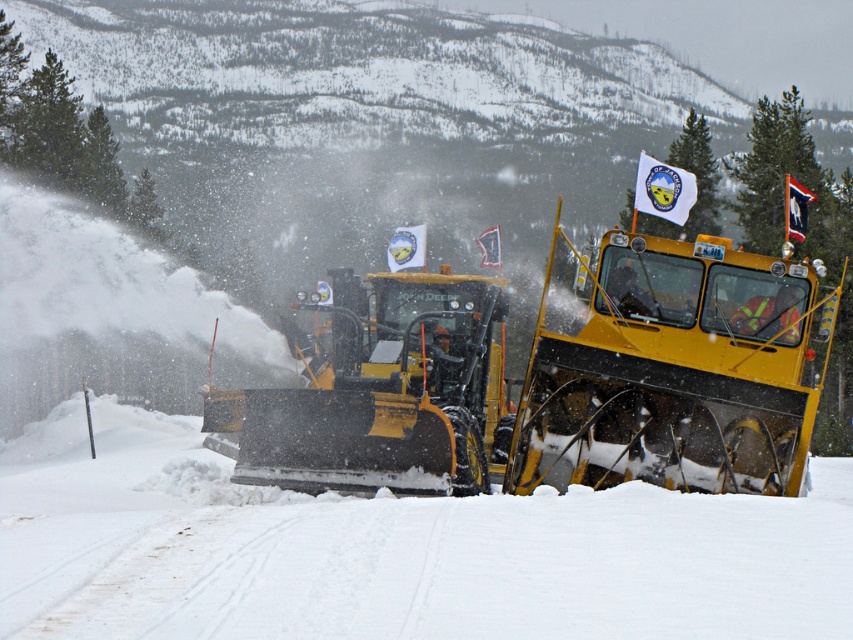
Question: Does yellow matte snowplow at center have a lesser width compared to yellow metal snowplow at center?

Choices:
 (A) no
 (B) yes

Answer: (A)

Question: Does yellow matte snowplow at center lie in front of yellow metal snowplow at center?

Choices:
 (A) no
 (B) yes

Answer: (B)

Question: Which object appears farthest from the camera in this image?

Choices:
 (A) yellow matte snowplow at center
 (B) yellow metal snowplow at center

Answer: (B)

Question: Which object is closer to the camera taking this photo?

Choices:
 (A) yellow metal snowplow at center
 (B) yellow matte snowplow at center

Answer: (B)

Question: Is yellow matte snowplow at center bigger than yellow metal snowplow at center?

Choices:
 (A) yes
 (B) no

Answer: (A)

Question: Which point is closer to the camera taking this photo?

Choices:
 (A) (495, 448)
 (B) (312, 445)

Answer: (B)